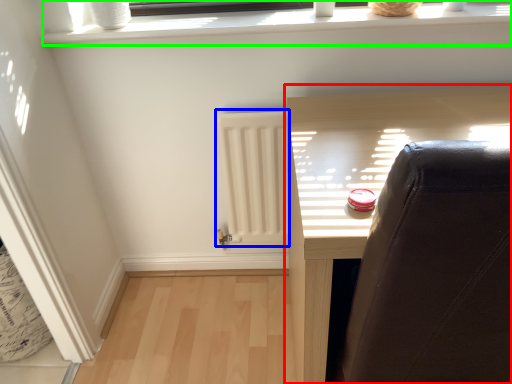
Question: Which object is the farthest from furniture (highlighted by a red box)? Choose among these: radiator (highlighted by a blue box) or window frame (highlighted by a green box).

Choices:
 (A) radiator
 (B) window frame

Answer: (B)